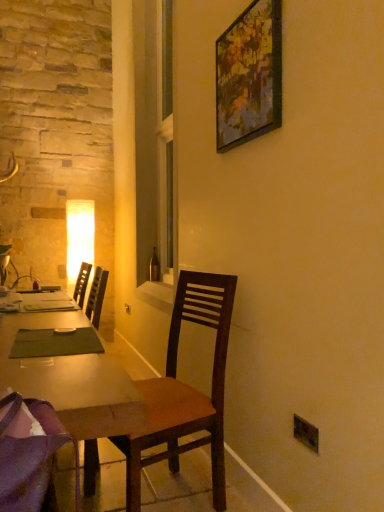
Question: Is brown glass bottle at center shorter than wooden desk at center?

Choices:
 (A) no
 (B) yes

Answer: (B)

Question: Is brown glass bottle at center located outside wooden desk at center?

Choices:
 (A) no
 (B) yes

Answer: (B)

Question: Could you tell me if brown glass bottle at center is turned towards wooden desk at center?

Choices:
 (A) no
 (B) yes

Answer: (A)

Question: Is brown glass bottle at center not close to wooden desk at center?

Choices:
 (A) yes
 (B) no

Answer: (A)

Question: Is wooden desk at center at the back of brown glass bottle at center?

Choices:
 (A) no
 (B) yes

Answer: (A)

Question: Is point (129, 310) positioned closer to the camera than point (170, 48)?

Choices:
 (A) farther
 (B) closer

Answer: (A)

Question: From the image's perspective, relative to clear glass window at center, is black plastic power outlet at lower right above or below?

Choices:
 (A) above
 (B) below

Answer: (B)

Question: In terms of height, does black plastic power outlet at lower right look taller or shorter compared to clear glass window at center?

Choices:
 (A) short
 (B) tall

Answer: (A)

Question: Is black plastic power outlet at lower right to the left or to the right of clear glass window at center in the image?

Choices:
 (A) right
 (B) left

Answer: (B)

Question: Would you say purple fabric chair at lower left, which ranks as the 2th chair in back-to-front order, is to the left or to the right of black plastic power outlet at lower right in the picture?

Choices:
 (A) left
 (B) right

Answer: (B)

Question: From the image's perspective, is purple fabric chair at lower left, which ranks as the 2th chair in back-to-front order, located above or below black plastic power outlet at lower right?

Choices:
 (A) above
 (B) below

Answer: (A)

Question: Is point 38,495 positioned closer to the camera than point 129,312?

Choices:
 (A) closer
 (B) farther

Answer: (A)

Question: From a real-world perspective, is purple fabric chair at lower left, which ranks as the 2th chair in back-to-front order, above or below black plastic power outlet at lower right?

Choices:
 (A) above
 (B) below

Answer: (A)

Question: From the image's perspective, relative to wooden chair at center, the first chair viewed from the back, is wooden picture frame at upper center above or below?

Choices:
 (A) above
 (B) below

Answer: (A)

Question: Is wooden picture frame at upper center situated inside wooden chair at center, the first chair viewed from the back, or outside?

Choices:
 (A) outside
 (B) inside

Answer: (A)